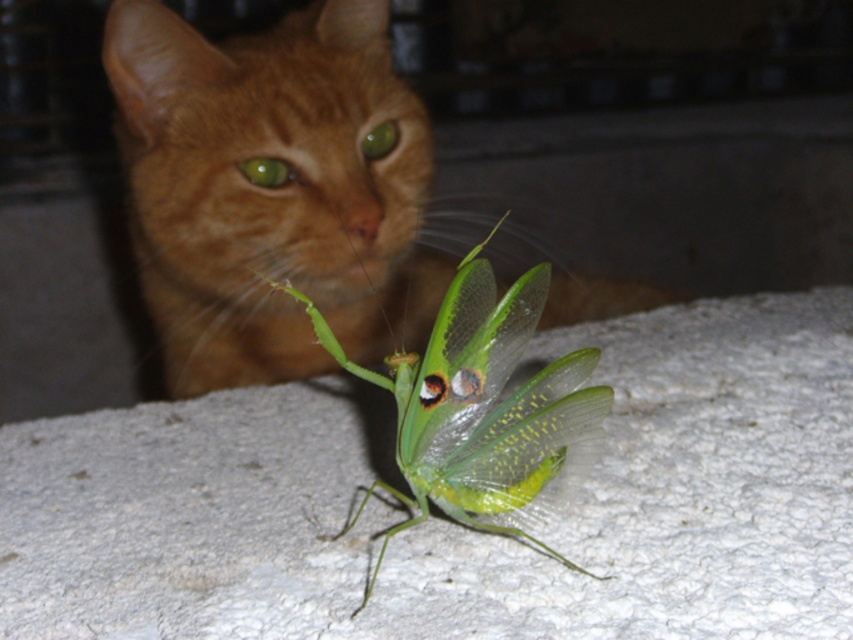
Question: Among these points, which one is farthest from the camera?

Choices:
 (A) (244, 272)
 (B) (466, 449)

Answer: (A)

Question: Is orange fur cat at upper center above green translucent mantis at center?

Choices:
 (A) yes
 (B) no

Answer: (A)

Question: Can you confirm if orange fur cat at upper center is wider than green translucent mantis at center?

Choices:
 (A) no
 (B) yes

Answer: (B)

Question: Which object appears farthest from the camera in this image?

Choices:
 (A) orange fur cat at upper center
 (B) green translucent mantis at center

Answer: (A)

Question: Does orange fur cat at upper center lie in front of green translucent mantis at center?

Choices:
 (A) no
 (B) yes

Answer: (A)

Question: Which object is farther from the camera taking this photo?

Choices:
 (A) green translucent mantis at center
 (B) orange fur cat at upper center

Answer: (B)